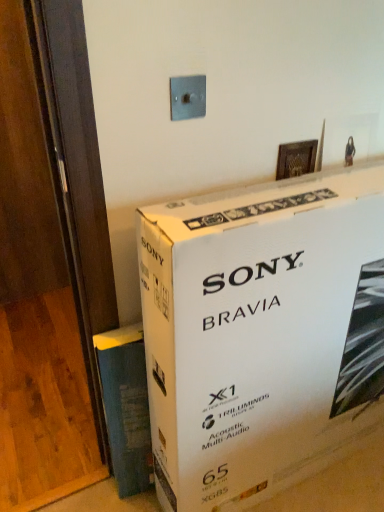
The height and width of the screenshot is (512, 384). In order to click on blank space situated above white cardboard box at upper center (from a real-world perspective) in this screenshot , I will do `click(299, 194)`.